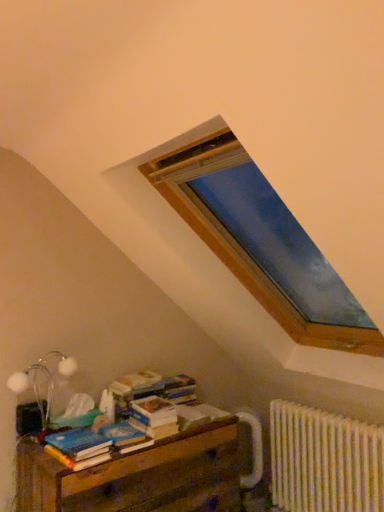
Question: From a real-world perspective, does blue matte paperback book at lower left, which ranks as the 2th paperback book in right-to-left order, sit lower than white textured radiator at lower right?

Choices:
 (A) no
 (B) yes

Answer: (A)

Question: Can you confirm if blue matte paperback book at lower left, the second paperback book positioned from the left, is positioned to the right of white textured radiator at lower right?

Choices:
 (A) no
 (B) yes

Answer: (A)

Question: From a real-world perspective, is blue matte paperback book at lower left, the second paperback book positioned from the left, physically above white textured radiator at lower right?

Choices:
 (A) no
 (B) yes

Answer: (B)

Question: Considering the relative sizes of blue matte paperback book at lower left, the second paperback book positioned from the left, and white textured radiator at lower right in the image provided, is blue matte paperback book at lower left, the second paperback book positioned from the left, bigger than white textured radiator at lower right?

Choices:
 (A) yes
 (B) no

Answer: (B)

Question: Is blue matte paperback book at lower left, the second paperback book positioned from the left, outside white textured radiator at lower right?

Choices:
 (A) yes
 (B) no

Answer: (A)

Question: Considering the relative positions of white textured radiator at lower right and white paper at center, the third paperback book in the left-to-right sequence, in the image provided, is white textured radiator at lower right to the left or to the right of white paper at center, the third paperback book in the left-to-right sequence,?

Choices:
 (A) right
 (B) left

Answer: (A)

Question: From a real-world perspective, is white textured radiator at lower right positioned above or below white paper at center, the third paperback book in the left-to-right sequence?

Choices:
 (A) above
 (B) below

Answer: (B)

Question: From the image's perspective, relative to white paper at center, the third paperback book in the left-to-right sequence, is white textured radiator at lower right above or below?

Choices:
 (A) below
 (B) above

Answer: (A)

Question: Would you say white textured radiator at lower right is inside or outside white paper at center, the third paperback book in the left-to-right sequence?

Choices:
 (A) inside
 (B) outside

Answer: (B)

Question: Does point (64, 456) appear closer or farther from the camera than point (178, 421)?

Choices:
 (A) closer
 (B) farther

Answer: (A)

Question: Looking at the image, does blue matte paperback book at lower left, the third paperback book from the right, seem bigger or smaller compared to white paper at center, the third paperback book in the left-to-right sequence?

Choices:
 (A) big
 (B) small

Answer: (A)

Question: Do you think blue matte paperback book at lower left, the first paperback book viewed from the left, is within white paper at center, placed as the first paperback book when sorted from right to left, or outside of it?

Choices:
 (A) outside
 (B) inside

Answer: (A)

Question: From a real-world perspective, is blue matte paperback book at lower left, the first paperback book viewed from the left, above or below white paper at center, placed as the first paperback book when sorted from right to left?

Choices:
 (A) below
 (B) above

Answer: (B)

Question: Is white matte table lamp at lower left situated inside wooden at lower left or outside?

Choices:
 (A) inside
 (B) outside

Answer: (B)

Question: From the image's perspective, is white matte table lamp at lower left located above or below wooden at lower left?

Choices:
 (A) above
 (B) below

Answer: (A)